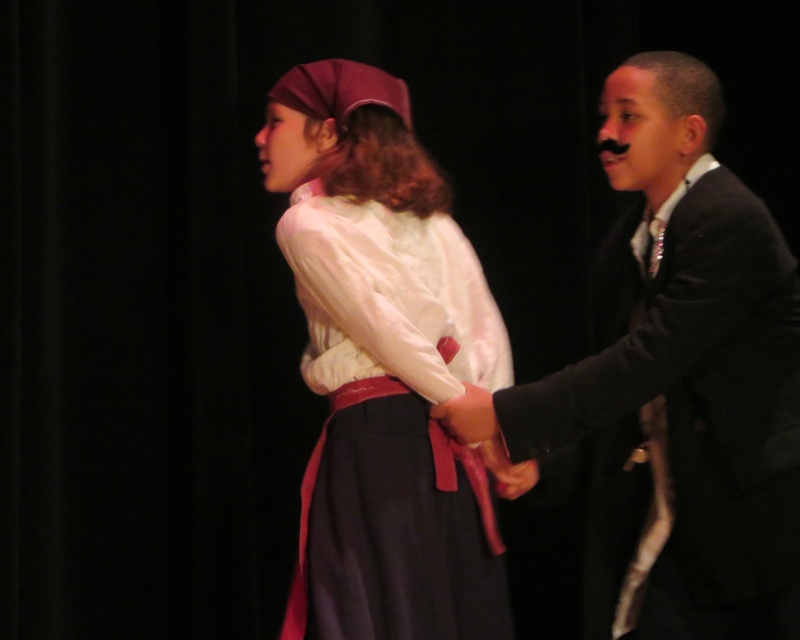
You are a stagehand who needs to ensure that all props and costumes fit through a narrow backstage door. The door has a width limit of 1 meter. Given the objects in the scene, which one between the black satin suit at right and the smooth leather hand at center is wider and thus might not fit through the door?

The black satin suit at right is wider than the smooth leather hand at center, so it might not fit through the door if it exceeds the 1 meter width limit.

You are an audience member sitting in the front row of the stage. You notice the black satin suit at right and the smooth leather hand at center. Which object is nearer to you?

The black satin suit at right is closer to the viewer than the smooth leather hand at center, so the black satin suit at right is nearer to you.

You are a photographer setting up for a stage performance. You need to place two lights at the locations of point (x=325, y=76) and point (x=492, y=417). Which light should be placed closer to the camera to ensure proper lighting?

The light at point (x=325, y=76) should be placed closer to the camera because it is further to the camera than point (x=492, y=417) according to the description.